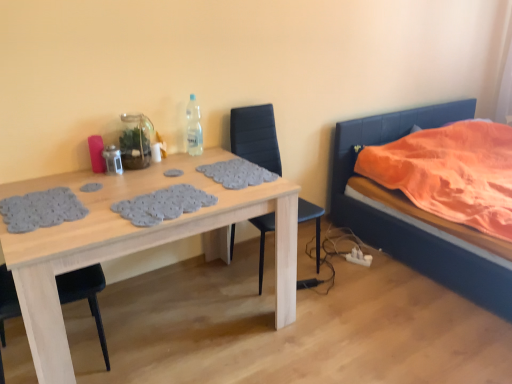
You are a GUI agent. You are given a task and a screenshot of the screen. Output one action in this format:
    pyautogui.click(x=<x>, y=<y>)
    Task: Click on the free area below wooden table at center (from a real-world perspective)
    Image resolution: width=512 pixels, height=384 pixels.
    Given the screenshot: What is the action you would take?
    pyautogui.click(x=175, y=317)